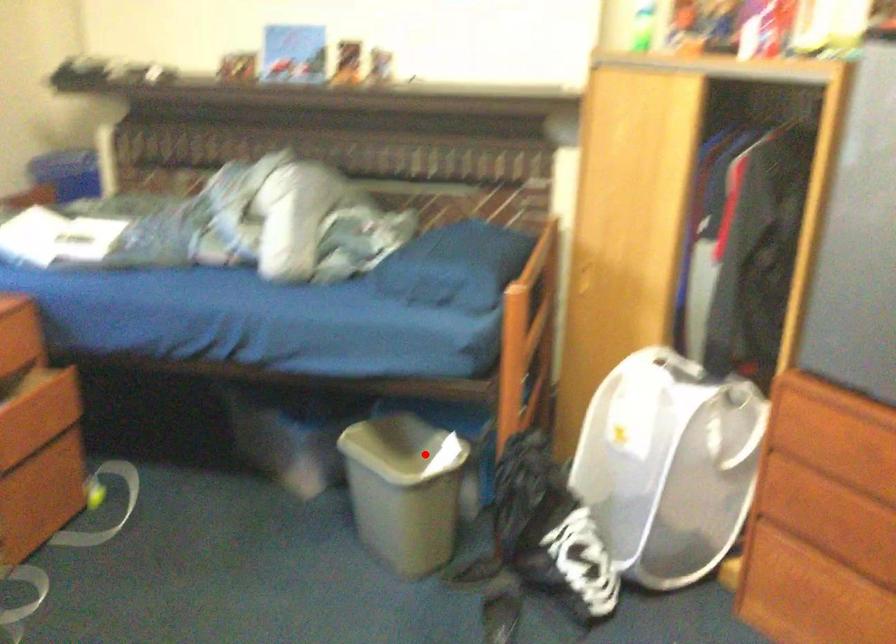
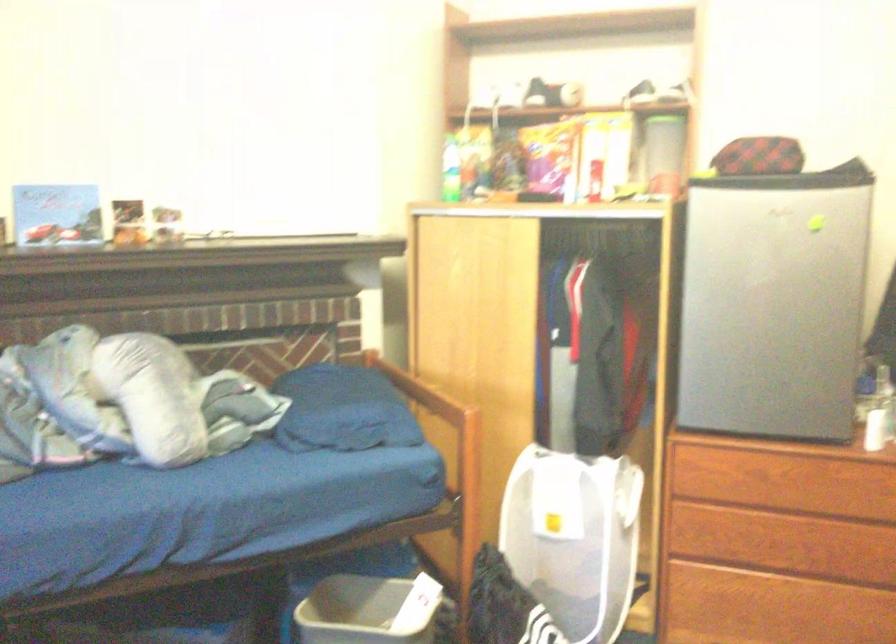
Locate, in the second image, the point that corresponds to the highlighted location in the first image.

(368, 611)